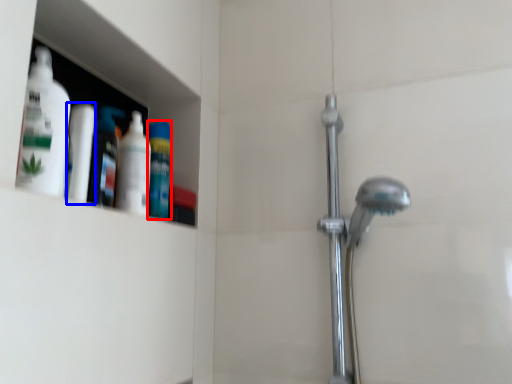
Question: Which point is closer to the camera, mouthwash (highlighted by a red box) or mouthwash (highlighted by a blue box)?

Choices:
 (A) mouthwash
 (B) mouthwash

Answer: (B)